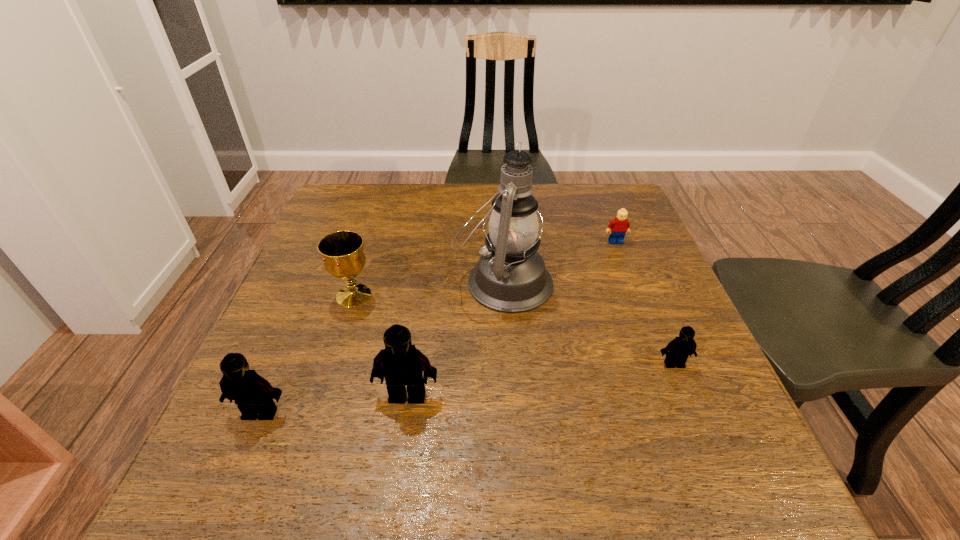
At what (x,y) coordinates should I click in order to perform the action: click on vacant space at the far right corner of the desktop. Please return your answer as a coordinate pair (x, y). This screenshot has width=960, height=540. Looking at the image, I should click on (636, 209).

Identify the location of free space that is in between the second object from left to right and the oil lamp. (428, 289).

Where is `vacant area that lies between the oil lamp and the leftmost Lego`? vacant area that lies between the oil lamp and the leftmost Lego is located at coordinates (382, 347).

The image size is (960, 540). I want to click on vacant area between the third Lego from right to left and the chalice, so click(x=380, y=346).

What are the coordinates of `free point between the second tallest Lego and the second object from left to right` in the screenshot? It's located at (307, 354).

Where is `vacant area that lies between the second object from left to right and the third nearest object`? Image resolution: width=960 pixels, height=540 pixels. vacant area that lies between the second object from left to right and the third nearest object is located at coordinates (514, 330).

Locate an element on the screen. The image size is (960, 540). unoccupied area between the third nearest Lego and the second object from left to right is located at coordinates (514, 330).

This screenshot has width=960, height=540. In order to click on vacant space that is in between the third shortest Lego and the third nearest Lego in this screenshot , I will do `click(468, 388)`.

Find the location of a particular element. vacant area that lies between the fourth object from right to left and the fourth farthest object is located at coordinates (540, 380).

This screenshot has width=960, height=540. Identify the location of empty location between the oil lamp and the third nearest Lego. [588, 323].